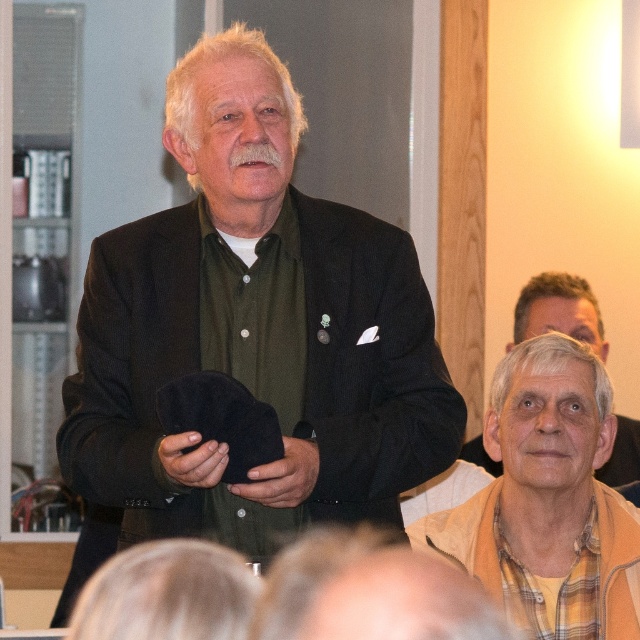
You are a tailor observing the scene and need to determine which garment requires more vertical space for storage. Based on the positions of the yellow plaid shirt at center and the gray woolen sweater at lower right, which one should be stored vertically?

The yellow plaid shirt at center is much taller than the gray woolen sweater at lower right, so it should be stored vertically to accommodate its height.

You are a photographer setting up for a group photo. You need to arrange two subjects wearing the dark green fabric shirt at center and the yellow plaid shirt at center so that both are visible in the frame. Given their height difference, where should you position them to ensure both are fully visible?

The dark green fabric shirt at center is much taller than the yellow plaid shirt at center. To ensure both are fully visible, position the taller dark green fabric shirt at center behind the shorter yellow plaid shirt at center.

You are a fashion designer observing the scene. You need to determine which clothing item has a larger size between the dark green fabric shirt at center and the gray woolen sweater at lower right. Based on the scene description, which one is larger?

The dark green fabric shirt at center is bigger than the gray woolen sweater at lower right according to the description.